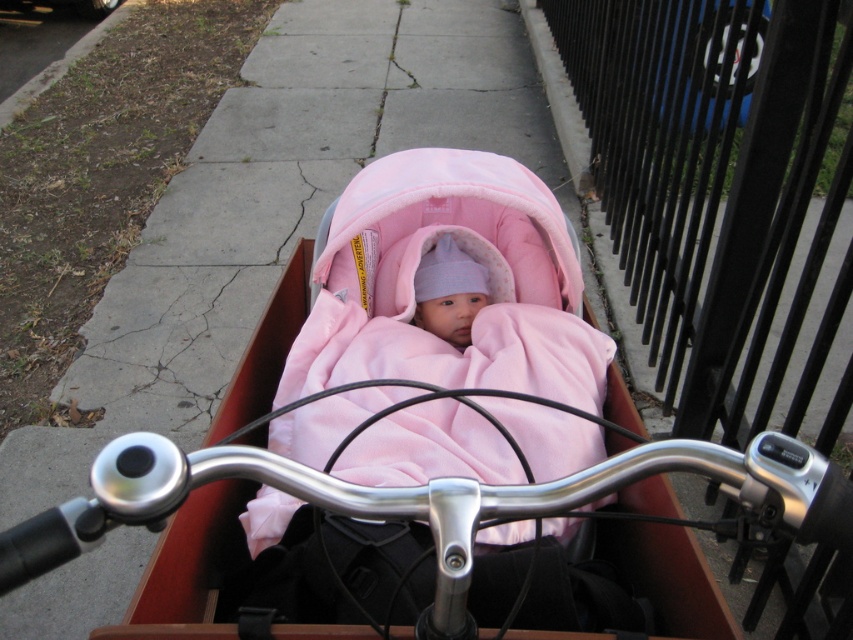
Question: Which of the following is the farthest from the observer?

Choices:
 (A) (181, 472)
 (B) (572, 428)
 (C) (467, 280)

Answer: (C)

Question: Is matte pink fabric baby carriage at center below pink fleece baby at center?

Choices:
 (A) no
 (B) yes

Answer: (B)

Question: Which point is closer to the camera?

Choices:
 (A) polished silver handlebars at center
 (B) matte pink fabric baby carriage at center

Answer: (A)

Question: Among these objects, which one is farthest from the camera?

Choices:
 (A) polished silver handlebars at center
 (B) pink fleece baby at center

Answer: (B)

Question: Is matte pink fabric baby carriage at center below pink fleece baby at center?

Choices:
 (A) no
 (B) yes

Answer: (B)

Question: Does matte pink fabric baby carriage at center appear under polished silver handlebars at center?

Choices:
 (A) yes
 (B) no

Answer: (B)